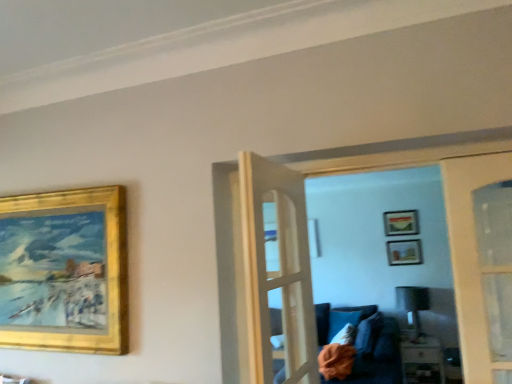
Question: Considering the relative sizes of gold/gilded picture frame at upper left, the third picture frame in the right-to-left sequence, and matte gold picture frame at upper center, the second picture frame in the front-to-back sequence, in the image provided, is gold/gilded picture frame at upper left, the third picture frame in the right-to-left sequence, shorter than matte gold picture frame at upper center, the second picture frame in the front-to-back sequence,?

Choices:
 (A) yes
 (B) no

Answer: (B)

Question: Could you tell me if gold/gilded picture frame at upper left, the first picture frame from the left, is turned towards matte gold picture frame at upper center, the second picture frame in the front-to-back sequence?

Choices:
 (A) yes
 (B) no

Answer: (B)

Question: Does gold/gilded picture frame at upper left, marked as the 3th picture frame in a back-to-front arrangement, have a smaller size compared to matte gold picture frame at upper center, acting as the 1th picture frame starting from the right?

Choices:
 (A) no
 (B) yes

Answer: (A)

Question: Does gold/gilded picture frame at upper left, the third picture frame in the right-to-left sequence, lie in front of matte gold picture frame at upper center, the second picture frame in the front-to-back sequence?

Choices:
 (A) yes
 (B) no

Answer: (A)

Question: Considering the relative sizes of gold/gilded picture frame at upper left, the third picture frame in the right-to-left sequence, and matte gold picture frame at upper center, the third picture frame viewed from the left, in the image provided, is gold/gilded picture frame at upper left, the third picture frame in the right-to-left sequence, bigger than matte gold picture frame at upper center, the third picture frame viewed from the left,?

Choices:
 (A) yes
 (B) no

Answer: (A)

Question: Do you think matte black lamp at center is within white fabric pillow at lower center, or outside of it?

Choices:
 (A) outside
 (B) inside

Answer: (A)

Question: Looking at their shapes, would you say matte black lamp at center is wider or thinner than white fabric pillow at lower center?

Choices:
 (A) wide
 (B) thin

Answer: (A)

Question: Considering the positions of matte black lamp at center and white fabric pillow at lower center in the image, is matte black lamp at center taller or shorter than white fabric pillow at lower center?

Choices:
 (A) short
 (B) tall

Answer: (B)

Question: Considering their positions, is matte black lamp at center located in front of or behind white fabric pillow at lower center?

Choices:
 (A) behind
 (B) front

Answer: (A)

Question: Choose the correct answer: Is matte gold picture frame at upper center, which is the second picture frame from right to left, inside gold/gilded picture frame at upper left, which is counted as the 1th picture frame, starting from the front, or outside it?

Choices:
 (A) inside
 (B) outside

Answer: (B)

Question: Is matte gold picture frame at upper center, which is counted as the 3th picture frame, starting from the front, wider or thinner than gold/gilded picture frame at upper left, marked as the 3th picture frame in a back-to-front arrangement?

Choices:
 (A) wide
 (B) thin

Answer: (A)

Question: From a real-world perspective, is matte gold picture frame at upper center, which is the second picture frame from right to left, physically located above or below gold/gilded picture frame at upper left, marked as the 3th picture frame in a back-to-front arrangement?

Choices:
 (A) above
 (B) below

Answer: (A)

Question: From the image's perspective, is matte gold picture frame at upper center, positioned as the second picture frame in left-to-right order, above or below gold/gilded picture frame at upper left, marked as the 3th picture frame in a back-to-front arrangement?

Choices:
 (A) above
 (B) below

Answer: (B)

Question: Is point (409, 213) positioned closer to the camera than point (408, 319)?

Choices:
 (A) closer
 (B) farther

Answer: (B)

Question: Is matte gold picture frame at upper center, acting as the first picture frame starting from the back, inside the boundaries of matte black lamp at center, or outside?

Choices:
 (A) outside
 (B) inside

Answer: (A)